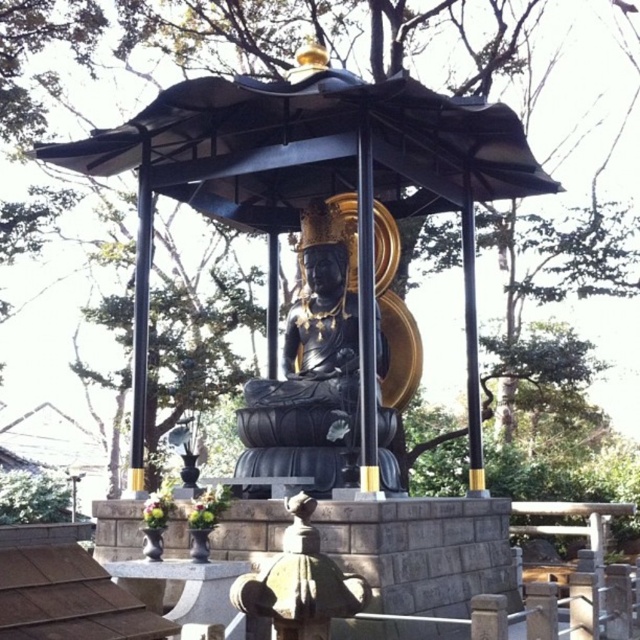
Can you confirm if black polished stone gazebo at center is taller than black polished pole at left?

Incorrect, black polished stone gazebo at center's height is not larger of black polished pole at left's.

Between point (472, 106) and point (145, 154), which one is positioned behind?

The point (145, 154) is more distant.

This screenshot has height=640, width=640. In order to click on black polished stone gazebo at center in this screenshot , I will do `click(321, 161)`.

At what (x,y) coordinates should I click in order to perform the action: click on black polished stone gazebo at center. Please return your answer as a coordinate pair (x, y). The width and height of the screenshot is (640, 640). Looking at the image, I should click on (321, 161).

Which is more to the left, black polished stone gazebo at center or black polished statue at center?

black polished stone gazebo at center

Which is behind, point (401, 196) or point (298, 465)?

The point (401, 196) is behind.

Image resolution: width=640 pixels, height=640 pixels. What are the coordinates of `black polished stone gazebo at center` in the screenshot? It's located at (321, 161).

Is metallic gold pole at center taller than black polished pole at left?

Incorrect, metallic gold pole at center's height is not larger of black polished pole at left's.

Does metallic gold pole at center have a smaller size compared to black polished pole at left?

Indeed, metallic gold pole at center has a smaller size compared to black polished pole at left.

This screenshot has width=640, height=640. Identify the location of metallic gold pole at center. (365, 320).

At what (x,y) coordinates should I click in order to perform the action: click on metallic gold pole at center. Please return your answer as a coordinate pair (x, y). This screenshot has width=640, height=640. Looking at the image, I should click on (365, 320).